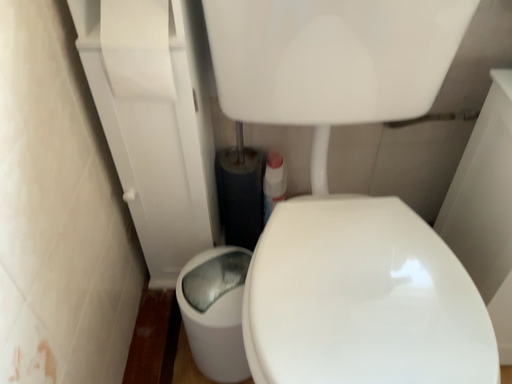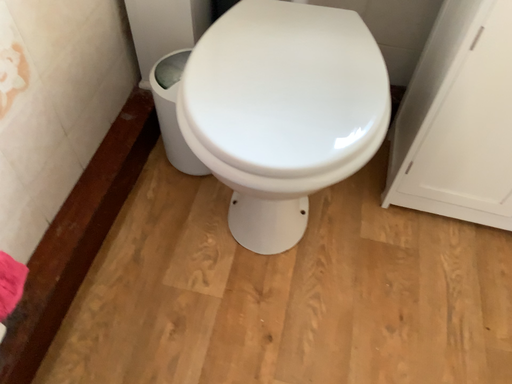
Question: How did the camera likely rotate when shooting the video?

Choices:
 (A) rotated right
 (B) rotated left

Answer: (B)